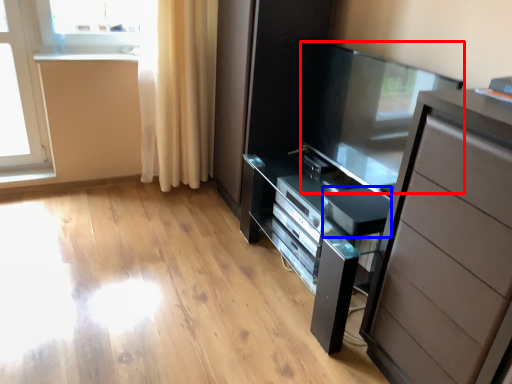
Question: Which of the following is the closest to the observer, screen door (highlighted by a red box) or appliance (highlighted by a blue box)?

Choices:
 (A) screen door
 (B) appliance

Answer: (A)